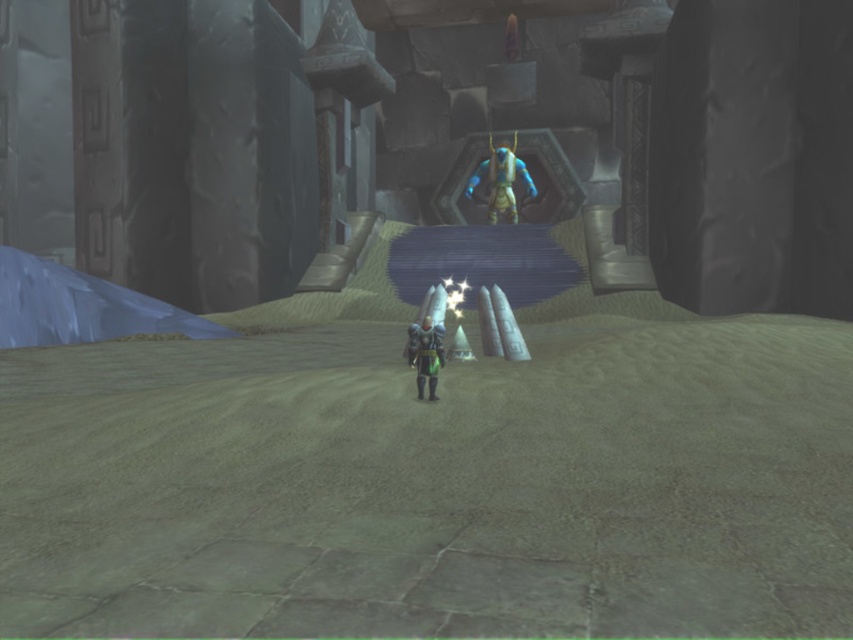
You are a character in the game who needs to reach the blue metallic armor at center. If your maximum jump height is 10 meters, can you reach it by jumping?

The blue metallic armor at center is 12.71 meters away from camera, so jumping with a maximum height of 10 meters won

You are navigating a video game level and need to place a new object at coordinates point A, which is at the same position as the blue metallic armor at center. What are the coordinates where you should place the new object?

The coordinates for placing the new object should be point A at the same location as the blue metallic armor at center, which is at point [502,182].

In the scene shown: You are a character in the game who needs to jump from the blue metallic armor at center to the shiny metallic armor at center. Given that your maximum jump distance is 30 feet, can you make the jump?

The blue metallic armor at center is 31.78 feet away from shiny metallic armor at center. Since your maximum jump distance is 30 feet, you cannot make the jump as the distance is greater than your capability.